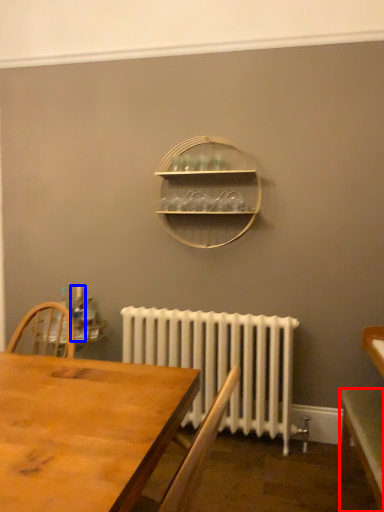
Question: Which point is closer to the camera, table (highlighted by a red box) or bottle (highlighted by a blue box)?

Choices:
 (A) table
 (B) bottle

Answer: (A)